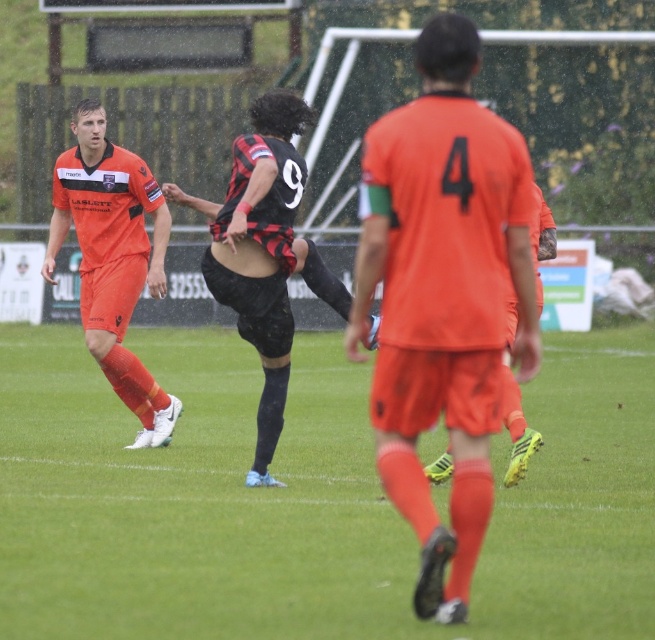
Question: Does orange matte jersey at center come in front of matte orange uniform at left?

Choices:
 (A) yes
 (B) no

Answer: (A)

Question: Which object is closer to the camera taking this photo?

Choices:
 (A) green grass at center
 (B) matte orange uniform at left
 (C) orange matte jersey at center
 (D) matte orange shorts at center

Answer: (A)

Question: Does orange matte jersey at center lie in front of matte orange uniform at left?

Choices:
 (A) no
 (B) yes

Answer: (B)

Question: Can you confirm if matte orange uniform at left is wider than matte orange shorts at center?

Choices:
 (A) no
 (B) yes

Answer: (B)

Question: Which of the following is the farthest from the observer?

Choices:
 (A) (466, 524)
 (B) (496, 486)
 (C) (86, 339)
 (D) (534, 189)

Answer: (C)

Question: Which point appears farthest from the camera in this image?

Choices:
 (A) (69, 154)
 (B) (476, 426)

Answer: (A)